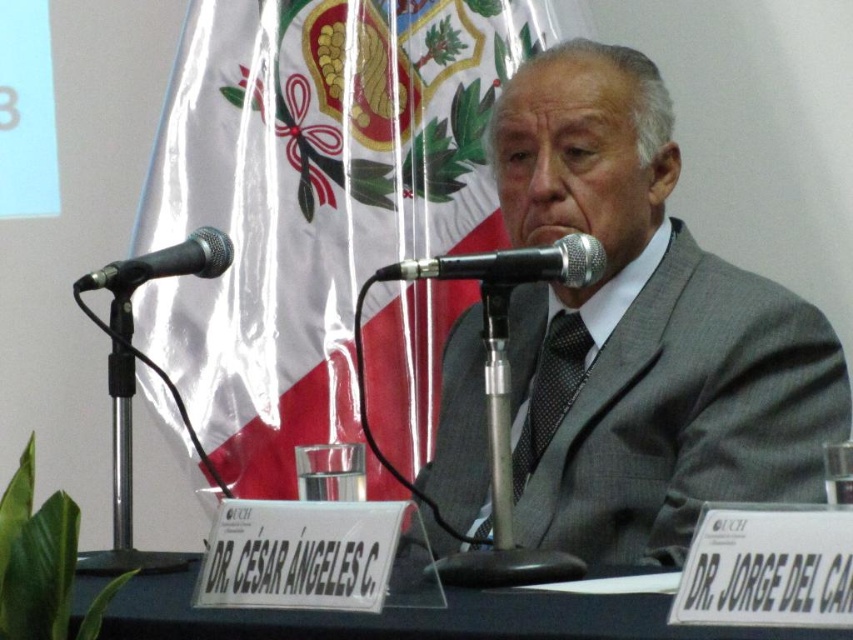
Who is taller, silky fabric flag at center or black metallic microphone at left?

silky fabric flag at center

Is silky fabric flag at center further to the viewer compared to black metallic microphone at left?

Yes.

Is point (370, 300) farther from viewer compared to point (173, 275)?

Yes, point (370, 300) is farther from viewer.

This screenshot has width=853, height=640. I want to click on silky fabric flag at center, so click(x=312, y=196).

Does silky fabric flag at center have a smaller size compared to black plastic table at center?

Incorrect, silky fabric flag at center is not smaller in size than black plastic table at center.

Between silky fabric flag at center and black plastic table at center, which one is positioned higher?

Positioned higher is silky fabric flag at center.

The image size is (853, 640). What do you see at coordinates (312, 196) in the screenshot? I see `silky fabric flag at center` at bounding box center [312, 196].

This screenshot has width=853, height=640. I want to click on silky fabric flag at center, so click(312, 196).

Which is more to the left, gray textured suit at center or black metallic microphone at left?

black metallic microphone at left is more to the left.

Is point (793, 385) farther from camera compared to point (216, 266)?

No, (793, 385) is closer to viewer.

Where is `gray textured suit at center`? This screenshot has width=853, height=640. gray textured suit at center is located at coordinates (642, 330).